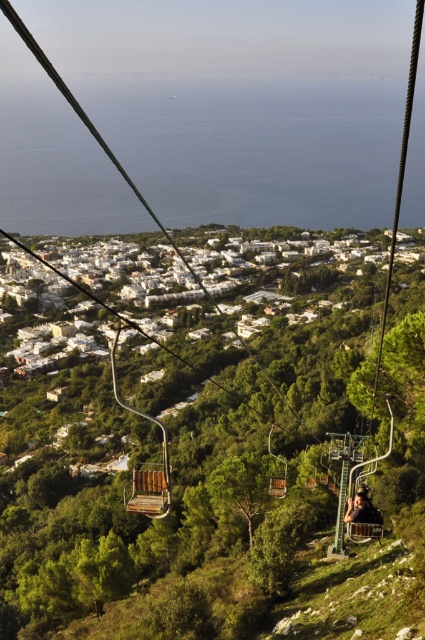
You are a photographer trying to capture a photo of the coastal town from the cable car. You notice the smooth brown hair at lower right and the wooden bench at center are in your shot. Which object would appear closer to the camera based on their sizes in the frame?

The smooth brown hair at lower right appears closer to the camera because it is larger in size than the wooden bench at center in the frame.